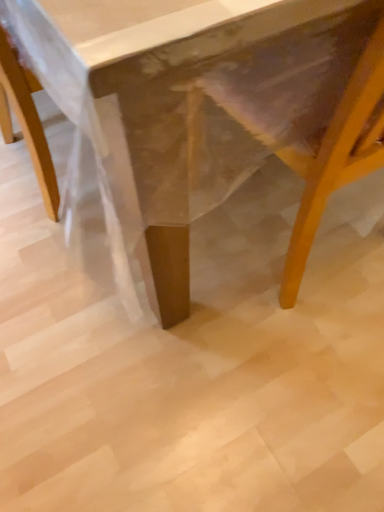
At what (x,y) coordinates should I click in order to perform the action: click on wooden swivel chair at lower right. Please return your answer as a coordinate pair (x, y). The width and height of the screenshot is (384, 512). Looking at the image, I should click on (302, 116).

In order to face wooden swivel chair at lower right, should I rotate leftwards or rightwards?

Rotate right and turn 20.268 degrees.

Measure the distance between point (272,135) and camera.

Point (272,135) and camera are 27.56 inches apart from each other.

The width and height of the screenshot is (384, 512). What do you see at coordinates (302, 116) in the screenshot?
I see `wooden swivel chair at lower right` at bounding box center [302, 116].

Identify the location of wooden table at center. (206, 108).

The image size is (384, 512). Describe the element at coordinates (206, 108) in the screenshot. I see `wooden table at center` at that location.

What is the approximate width of wooden table at center?

→ The width of wooden table at center is 1.12 meters.

The image size is (384, 512). Identify the location of wooden swivel chair at lower right. (302, 116).

Is wooden swivel chair at lower right to the left of wooden table at center from the viewer's perspective?

No, wooden swivel chair at lower right is not to the left of wooden table at center.

Is wooden swivel chair at lower right in front of wooden table at center?

No, wooden swivel chair at lower right is behind wooden table at center.

Considering the positions of point (254, 130) and point (55, 40), is point (254, 130) closer or farther from the camera than point (55, 40)?

Point (254, 130).

In the scene shown: From the image's perspective, which one is positioned higher, wooden swivel chair at lower right or wooden table at center?

wooden table at center.

From a real-world perspective, who is located lower, wooden swivel chair at lower right or wooden table at center?

wooden swivel chair at lower right is physically lower.

Which of these two, wooden swivel chair at lower right or wooden table at center, is wider?

wooden table at center is wider.

Does wooden swivel chair at lower right have a lesser height compared to wooden table at center?

Yes.

Between wooden swivel chair at lower right and wooden table at center, which one has larger size?

Bigger between the two is wooden table at center.

Is wooden table at center a part of wooden swivel chair at lower right?

No, wooden table at center is located outside of wooden swivel chair at lower right.

Are wooden swivel chair at lower right and wooden table at center located far from each other?

Actually, wooden swivel chair at lower right and wooden table at center are a little close together.

Is wooden swivel chair at lower right facing away from wooden table at center?

Yes, wooden swivel chair at lower right's orientation is away from wooden table at center.

The width and height of the screenshot is (384, 512). What are the coordinates of `table on the left of wooden swivel chair at lower right` in the screenshot? It's located at (206, 108).

Between wooden table at center and wooden swivel chair at lower right, which one appears on the right side from the viewer's perspective?

wooden swivel chair at lower right.

Relative to wooden swivel chair at lower right, is wooden table at center in front or behind?

wooden table at center is positioned closer to the viewer than wooden swivel chair at lower right.

Which point is more forward, (x=156, y=192) or (x=213, y=128)?

Point (x=156, y=192)

From the image's perspective, which is below, wooden table at center or wooden swivel chair at lower right?

wooden swivel chair at lower right, from the image's perspective.

Consider the image. From a real-world perspective, is wooden table at center positioned under wooden swivel chair at lower right based on gravity?

Actually, wooden table at center is physically above wooden swivel chair at lower right in the real world.

In terms of width, does wooden table at center look wider or thinner when compared to wooden swivel chair at lower right?

In the image, wooden table at center appears to be wider than wooden swivel chair at lower right.

Does wooden table at center have a greater height compared to wooden swivel chair at lower right?

Yes.

Which of these two, wooden table at center or wooden swivel chair at lower right, is bigger?

wooden table at center is bigger.

Is wooden swivel chair at lower right located within wooden table at center?

Yes, wooden table at center is surrounding wooden swivel chair at lower right.

Are wooden table at center and wooden swivel chair at lower right located far from each other?

wooden table at center is actually quite close to wooden swivel chair at lower right.

Is wooden table at center looking in the opposite direction of wooden swivel chair at lower right?

No, wooden table at center's orientation is not away from wooden swivel chair at lower right.

Can you tell me how much wooden table at center and wooden swivel chair at lower right differ in facing direction?

The facing directions of wooden table at center and wooden swivel chair at lower right are 88.7 degrees apart.

I want to click on swivel chair lying below the wooden table at center (from the image's perspective), so click(x=302, y=116).

What are the coordinates of `table that is above the wooden swivel chair at lower right (from a real-world perspective)` in the screenshot? It's located at (206, 108).

Identify the location of swivel chair that is under the wooden table at center (from a real-world perspective). The height and width of the screenshot is (512, 384). (302, 116).